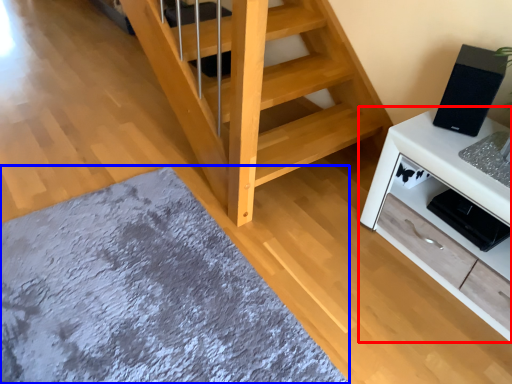
Question: Which point is further to the camera, cabinetry (highlighted by a red box) or mat (highlighted by a blue box)?

Choices:
 (A) cabinetry
 (B) mat

Answer: (A)